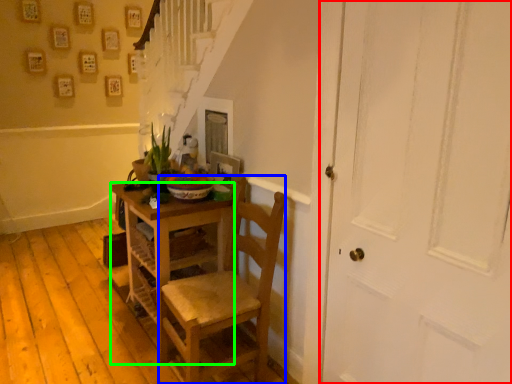
Question: Which object is positioned farthest from door (highlighted by a red box)? Select from chair (highlighted by a blue box) and desk (highlighted by a green box).

Choices:
 (A) chair
 (B) desk

Answer: (B)